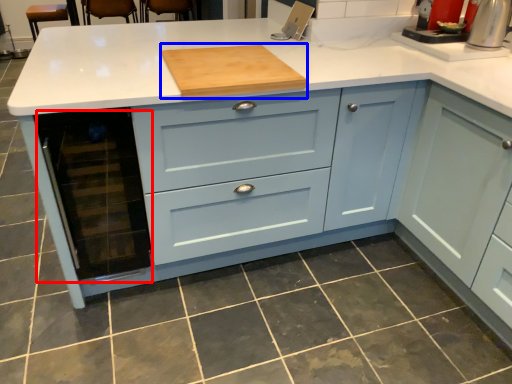
Question: Which object appears farthest to the camera in this image, appliance (highlighted by a red box) or kitchen appliance (highlighted by a blue box)?

Choices:
 (A) appliance
 (B) kitchen appliance

Answer: (B)